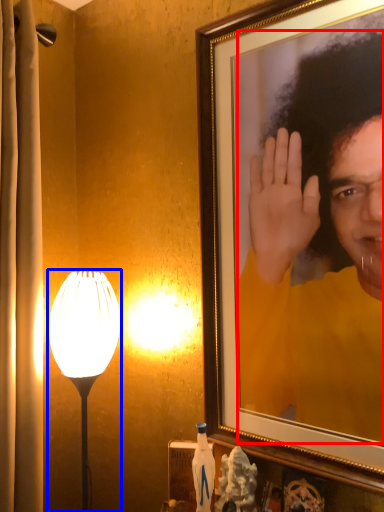
Question: Which of the following is the farthest to the observer, person (highlighted by a red box) or lamp (highlighted by a blue box)?

Choices:
 (A) person
 (B) lamp

Answer: (B)